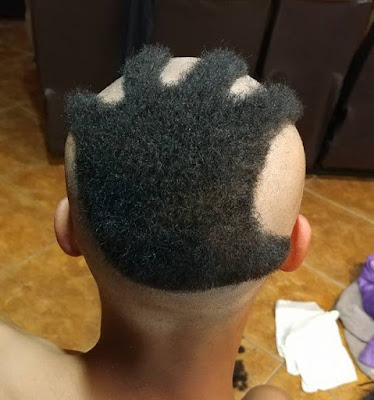
Locate an element on the screen. This screenshot has height=400, width=374. cabinets is located at coordinates (353, 141), (317, 46), (224, 28), (59, 44).